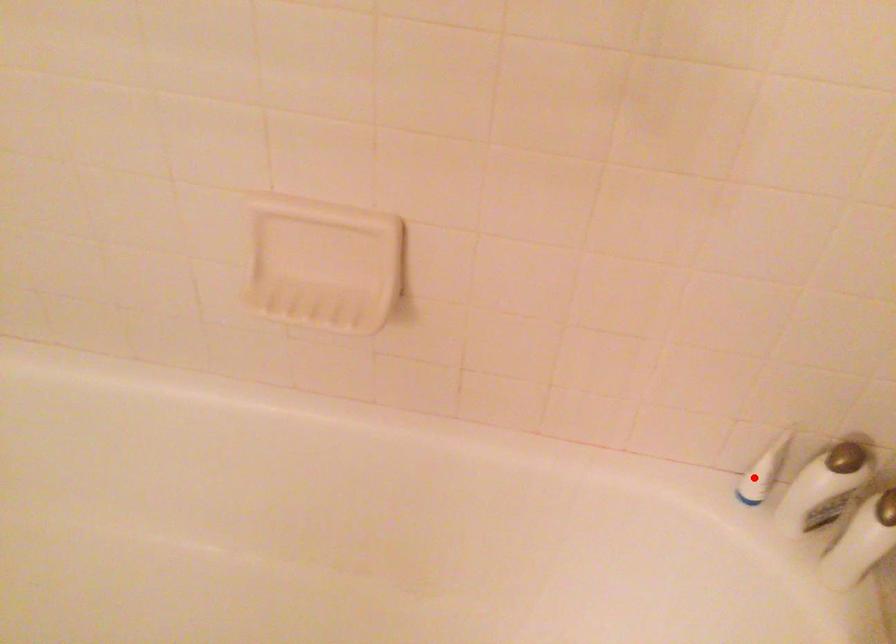
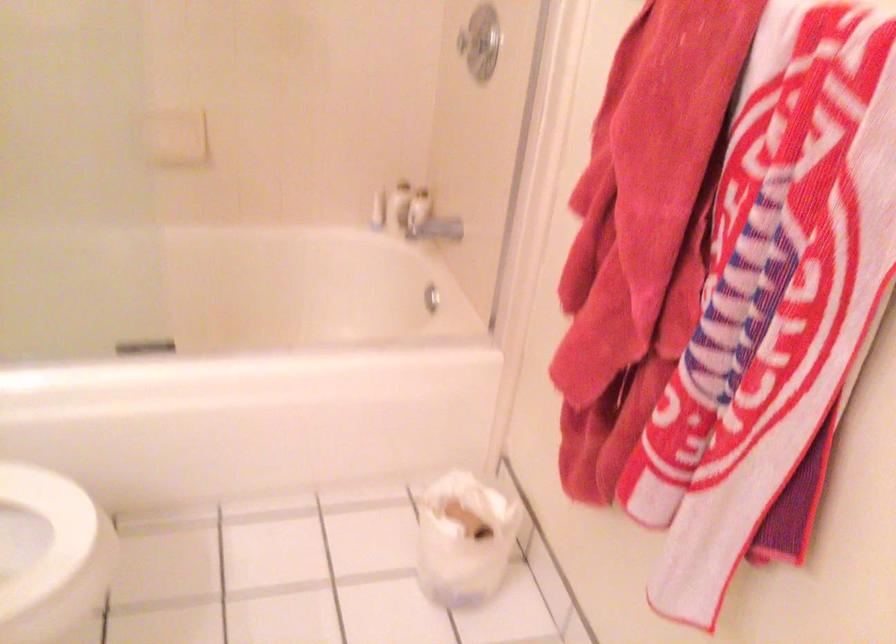
Question: I am providing you with two images of the same scene from different viewpoints. Given a red point in image1, look at the same physical point in image2. Is it:

Choices:
 (A) Closer to the viewpoint
 (B) Farther from the viewpoint

Answer: (B)